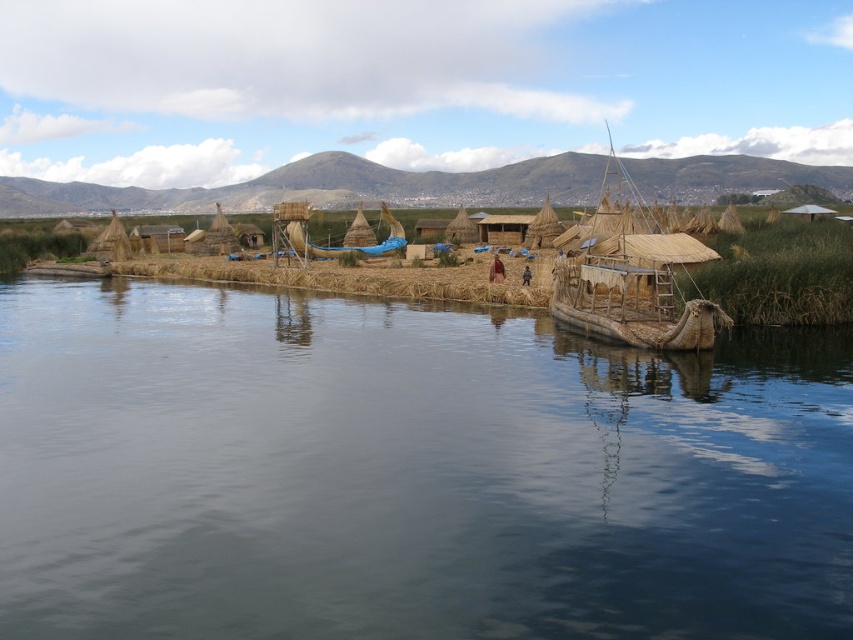
You are a visitor planning to take a boat tour on the lake. You see two boats available for hire, the natural woven reed boat at center and the blue fabric boat at center. The tour guide says that the boat you choose must be within 100 feet of the other to ensure safety. Can you safely choose either boat for your tour?

The natural woven reed boat at center is 116.83 feet from the blue fabric boat at center. Since the distance between them is more than 100 feet, you cannot safely choose either boat for your tour as they are too far apart to meet the safety requirement.

You are standing on the lakeside and want to take a photo of the natural woven reed boat at center. Which direction should you face to ensure the dark blue water at lower center is not blocking your view?

You should face to the right of the natural woven reed boat at center to avoid the dark blue water at lower center, since the water is located to the left of the boat.